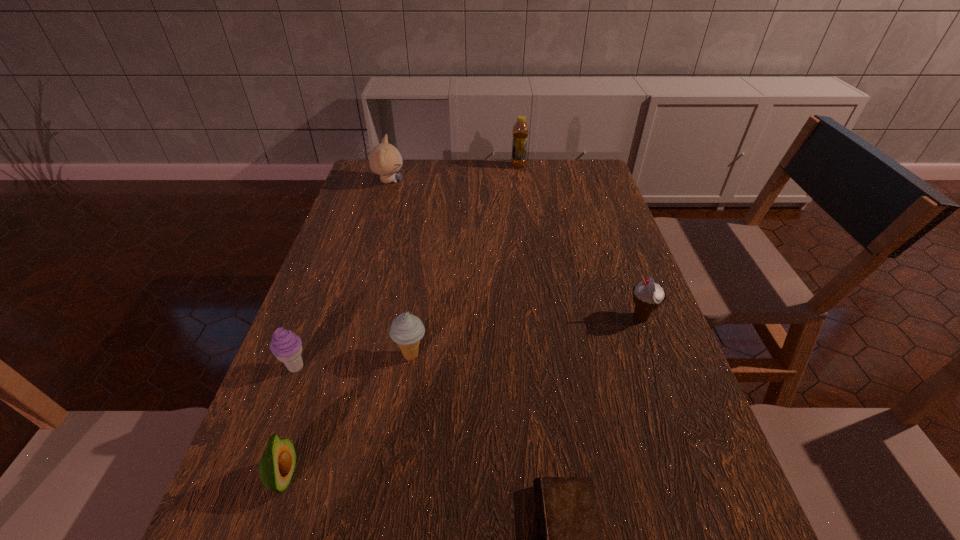
Image resolution: width=960 pixels, height=540 pixels. What are the coordinates of `object that is at the far left corner` in the screenshot? It's located at (385, 160).

At what (x,y) coordinates should I click in order to perform the action: click on free spot at the far edge of the desktop. Please return your answer as a coordinate pair (x, y). Looking at the image, I should click on (525, 166).

Find the location of a particular element. Image resolution: width=960 pixels, height=540 pixels. blank space at the left edge is located at coordinates (359, 268).

The height and width of the screenshot is (540, 960). Find the location of `vacant space at the right edge`. vacant space at the right edge is located at coordinates (604, 306).

The height and width of the screenshot is (540, 960). Identify the location of vacant space at the far right corner of the desktop. (586, 166).

Find the location of `free space that is in between the avocado and the leftmost icecream`. free space that is in between the avocado and the leftmost icecream is located at coordinates (290, 422).

Where is `empty space that is in between the avocado and the leftmost icecream`? empty space that is in between the avocado and the leftmost icecream is located at coordinates (290, 422).

Identify the location of empty space between the avocado and the leftmost icecream. (290, 422).

Where is `vacant space in between the third farthest object and the farthest object`? vacant space in between the third farthest object and the farthest object is located at coordinates (580, 241).

Find the location of a particular element. The height and width of the screenshot is (540, 960). empty space that is in between the farthest icecream and the leftmost icecream is located at coordinates pyautogui.click(x=468, y=342).